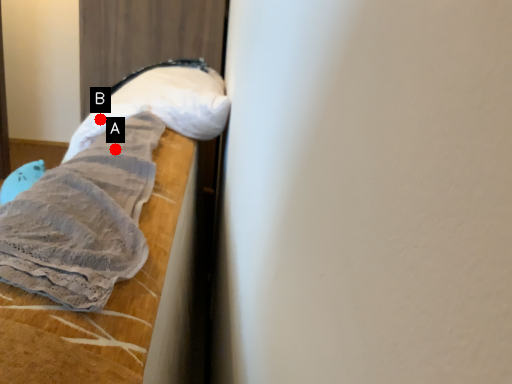
Question: Two points are circled on the image, labeled by A and B beside each circle. Which point is closer to the camera?

Choices:
 (A) A is closer
 (B) B is closer

Answer: (A)